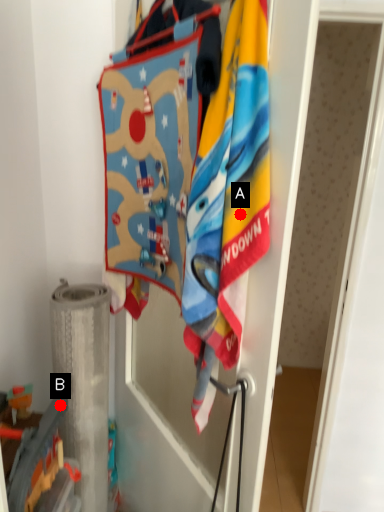
Question: Two points are circled on the image, labeled by A and B beside each circle. Which point appears farthest from the camera in this image?

Choices:
 (A) A is further
 (B) B is further

Answer: (B)